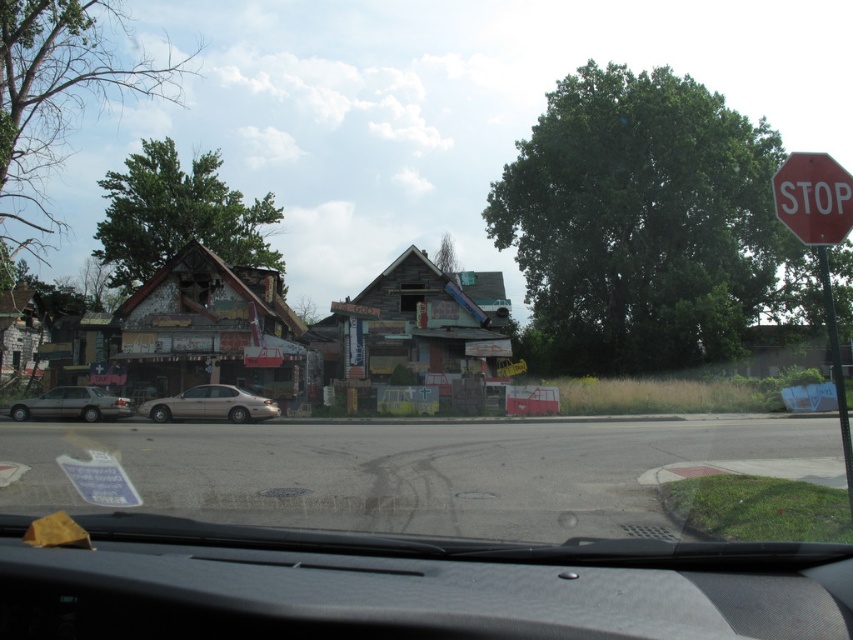
Describe the element at coordinates (813, 198) in the screenshot. I see `red plastic stop sign at upper right` at that location.

Does red plastic stop sign at upper right have a greater width compared to silver metallic sedan at left?

Yes.

Identify the location of red plastic stop sign at upper right. (813, 198).

Where is `red plastic stop sign at upper right`? The width and height of the screenshot is (853, 640). red plastic stop sign at upper right is located at coordinates (813, 198).

Consider the image. Does transparent glass windshield at lower center appear under silver metallic sedan at left?

Incorrect, transparent glass windshield at lower center is not positioned below silver metallic sedan at left.

Where is `transparent glass windshield at lower center`? transparent glass windshield at lower center is located at coordinates (453, 476).

Identify the location of transparent glass windshield at lower center. (453, 476).

Identify the location of transparent glass windshield at lower center. (453, 476).

Is transparent glass windshield at lower center in front of metallic pole at right?

Yes, it is in front of metallic pole at right.

Locate an element on the screen. Image resolution: width=853 pixels, height=640 pixels. transparent glass windshield at lower center is located at coordinates (453, 476).